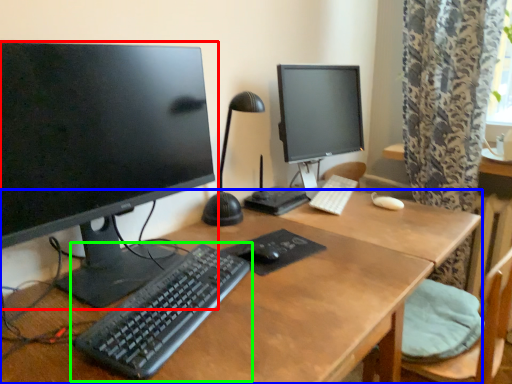
Question: Which object is the farthest from computer monitor (highlighted by a red box)? Choose among these: desk (highlighted by a blue box) or computer keyboard (highlighted by a green box).

Choices:
 (A) desk
 (B) computer keyboard

Answer: (A)